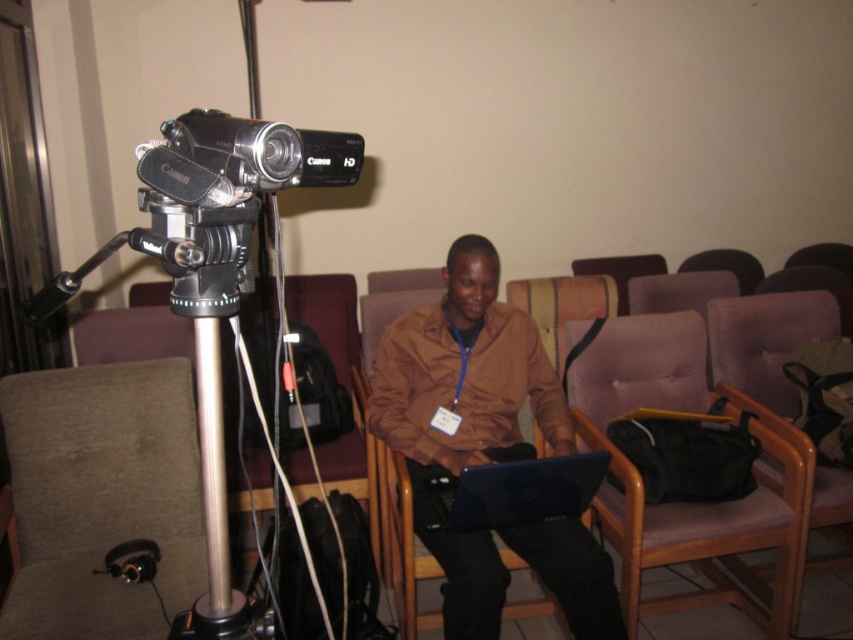
Question: Can you confirm if silver metallic tripod at left is positioned to the right of silver metallic pole at center?

Choices:
 (A) no
 (B) yes

Answer: (A)

Question: Among these points, which one is farthest from the camera?

Choices:
 (A) (599, 458)
 (B) (194, 608)

Answer: (A)

Question: Which is farther from the silver metallic pole at center?

Choices:
 (A) black plastic camera at left
 (B) blue glossy laptop at center
 (C) silver metallic tripod at left
 (D) brown matte shirt at center

Answer: (D)

Question: Can you confirm if brown matte shirt at center is wider than blue glossy laptop at center?

Choices:
 (A) yes
 (B) no

Answer: (A)

Question: Which of these objects is positioned farthest from the silver metallic tripod at left?

Choices:
 (A) black plastic camera at left
 (B) blue glossy laptop at center
 (C) brown matte shirt at center
 (D) silver metallic pole at center

Answer: (C)

Question: Is brown matte shirt at center in front of silver metallic pole at center?

Choices:
 (A) yes
 (B) no

Answer: (B)